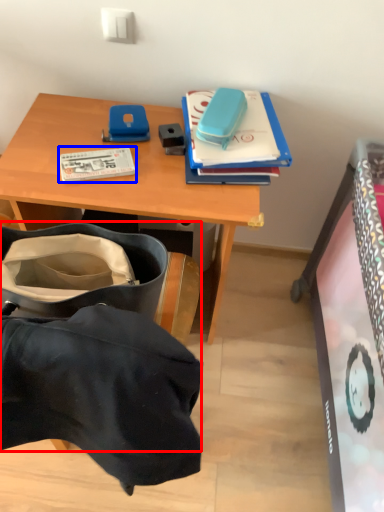
Question: Which object appears farthest to the camera in this image, luggage and bags (highlighted by a red box) or book (highlighted by a blue box)?

Choices:
 (A) luggage and bags
 (B) book

Answer: (B)